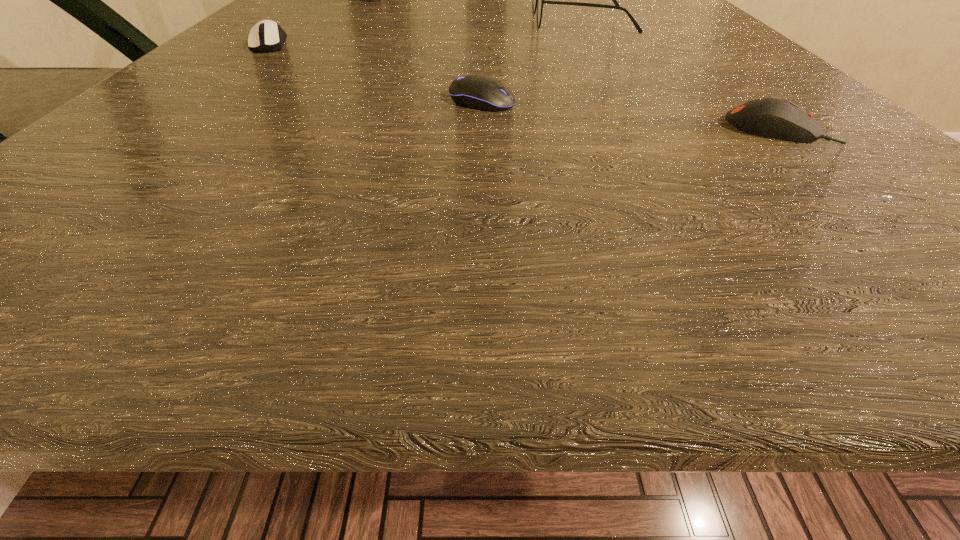
I want to click on spectacles, so click(x=538, y=0).

Identify the location of the fourth nearest object. (538, 0).

Locate an element on the screen. The width and height of the screenshot is (960, 540). the farthest computer mouse is located at coordinates (270, 36).

This screenshot has height=540, width=960. I want to click on the third nearest object, so click(x=270, y=36).

This screenshot has height=540, width=960. Identify the location of the rightmost object. (768, 117).

The width and height of the screenshot is (960, 540). Find the location of `the nearest object`. the nearest object is located at coordinates (768, 117).

Locate an element on the screen. the second computer mouse from right to left is located at coordinates (477, 92).

What are the coordinates of `the fourth farthest object` in the screenshot? It's located at (477, 92).

Locate an element on the screen. free location located on the front-facing side of the second tallest object is located at coordinates (360, 21).

Locate an element on the screen. vacant region located 0.390m on the front-facing side of the second tallest object is located at coordinates (315, 21).